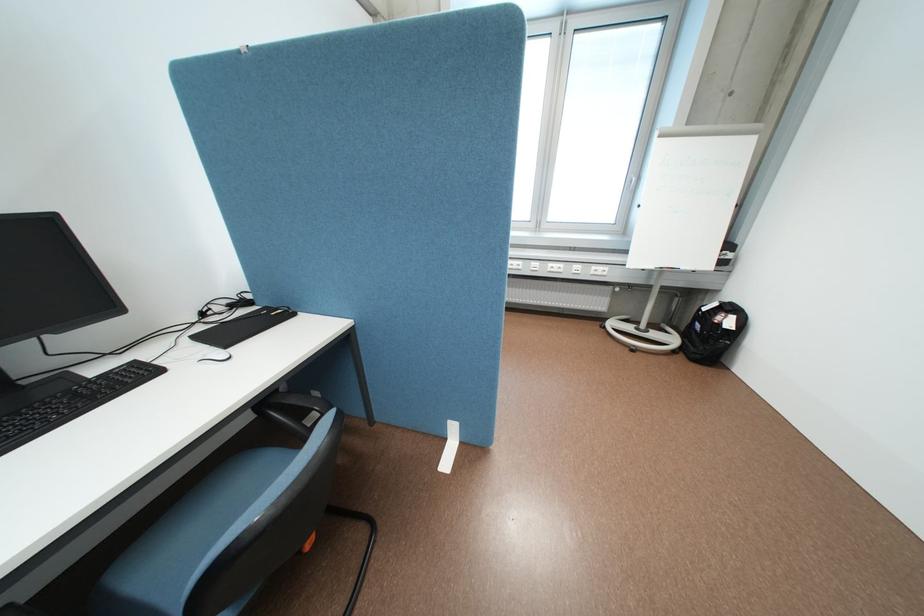
Where is `white power outlet`? white power outlet is located at coordinates (599, 270).